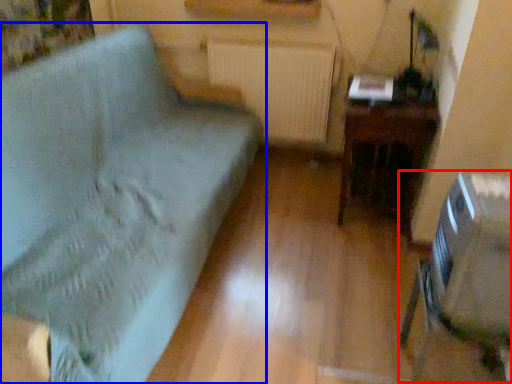
Question: Which object appears farthest to the camera in this image, swivel chair (highlighted by a red box) or furniture (highlighted by a blue box)?

Choices:
 (A) swivel chair
 (B) furniture

Answer: (A)